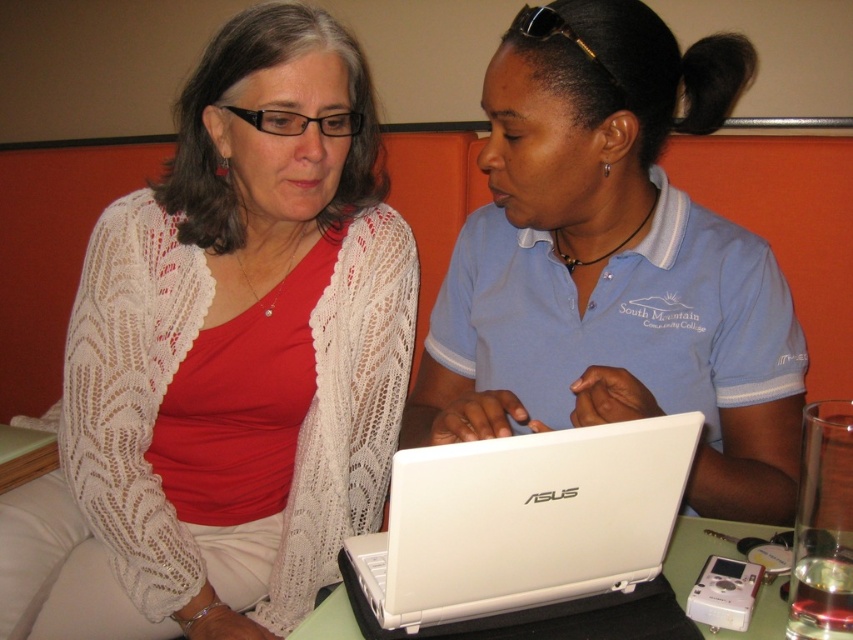
Consider the image. Is matte white laptop at center to the left of white plastic laptop at center from the viewer's perspective?

Indeed, matte white laptop at center is positioned on the left side of white plastic laptop at center.

Measure the distance between point (637, 355) and camera.

Point (637, 355) is 1.02 meters away from camera.

Who is more forward, [538,266] or [782,632]?

Point [782,632]

You are a GUI agent. You are given a task and a screenshot of the screen. Output one action in this format:
    pyautogui.click(x=<x>, y=<y>)
    Task: Click on the matte white laptop at center
    This screenshot has height=640, width=853.
    Given the screenshot: What is the action you would take?
    pyautogui.click(x=613, y=262)

Is point (434, 374) positioned after point (519, 497)?

Yes.

Is point (502, 339) positioned behind point (345, 557)?

Yes.

Where is `matte white laptop at center`? matte white laptop at center is located at coordinates (613, 262).

Between point (614, 218) and point (134, 618), which one is positioned behind?

The point (134, 618) is more distant.

Can you confirm if matte white laptop at center is positioned to the left of white lace cardigan at center?

In fact, matte white laptop at center is to the right of white lace cardigan at center.

Is point (467, 362) positioned behind point (13, 529)?

That is True.

Locate an element on the screen. matte white laptop at center is located at coordinates (613, 262).